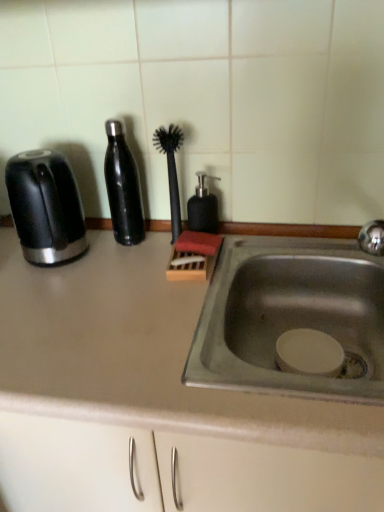
Find the location of a particular element. Image resolution: width=384 pixels, height=512 pixels. black glossy toaster at left is located at coordinates (45, 207).

What is the approximate width of matte gray countertop at center?

24.49 inches.

Image resolution: width=384 pixels, height=512 pixels. I want to click on stainless steel sink at center, so click(x=290, y=316).

Image resolution: width=384 pixels, height=512 pixels. I want to click on black matte soap dispenser at center, so click(x=203, y=207).

What do you see at coordinates (203, 207) in the screenshot? Image resolution: width=384 pixels, height=512 pixels. I see `black matte soap dispenser at center` at bounding box center [203, 207].

Image resolution: width=384 pixels, height=512 pixels. Identify the location of black rubber brush at center. (171, 170).

I want to click on satin black bottle at center left, so click(123, 187).

This screenshot has width=384, height=512. Find the location of `black glossy toaster at left`. black glossy toaster at left is located at coordinates (45, 207).

You are a GUI agent. You are given a task and a screenshot of the screen. Output one action in this format:
    pyautogui.click(x=<x>, y=<y>)
    Task: Click on the toaster beneath the black rubber brush at center (from a real-world perspective)
    
    Given the screenshot: What is the action you would take?
    pyautogui.click(x=45, y=207)

From the image's perspective, relative to black rubber brush at center, is black glossy toaster at left above or below?

From the image's perspective, black glossy toaster at left appears below black rubber brush at center.

Which of these two, black glossy toaster at left or black rubber brush at center, is bigger?

With larger size is black glossy toaster at left.

In the scene shown: Which of these two, black glossy toaster at left or black rubber brush at center, stands taller?

black rubber brush at center is taller.

Which of these two, satin black bottle at center left or matte gray countertop at center, is smaller?

With smaller size is satin black bottle at center left.

Considering the positions of point (139, 206) and point (205, 490), is point (139, 206) closer or farther from the camera than point (205, 490)?

Clearly, point (139, 206) is more distant from the camera than point (205, 490).

Based on the photo, considering the positions of objects satin black bottle at center left and matte gray countertop at center in the image provided, who is more to the left, satin black bottle at center left or matte gray countertop at center?

Positioned to the left is satin black bottle at center left.

From a real-world perspective, is black rubber brush at center under matte gray countertop at center?

Incorrect, from a real-world perspective, black rubber brush at center is higher than matte gray countertop at center.

I want to click on countertop in front of the black rubber brush at center, so click(153, 400).

From the image's perspective, would you say black rubber brush at center is shown under matte gray countertop at center?

Actually, black rubber brush at center appears above matte gray countertop at center in the image.

Which of these two, black rubber brush at center or matte gray countertop at center, is wider?

With larger width is matte gray countertop at center.

From the image's perspective, which is below, black matte soap dispenser at center or stainless steel sink at center?

stainless steel sink at center is shown below in the image.

The height and width of the screenshot is (512, 384). Identify the location of sink located in front of the black matte soap dispenser at center. (290, 316).

Would you consider black matte soap dispenser at center to be distant from stainless steel sink at center?

No.

Which of these two, black glossy toaster at left or black matte soap dispenser at center, stands taller?

Standing taller between the two is black glossy toaster at left.

Which object is wider, black glossy toaster at left or black matte soap dispenser at center?

black glossy toaster at left.

From the image's perspective, is black glossy toaster at left on top of black matte soap dispenser at center?

No.

Can you confirm if black glossy toaster at left is positioned to the right of black matte soap dispenser at center?

In fact, black glossy toaster at left is to the left of black matte soap dispenser at center.

In the scene shown: Measure the distance between satin black bottle at center left and stainless steel sink at center.

satin black bottle at center left is 15.16 inches from stainless steel sink at center.

Is satin black bottle at center left not within stainless steel sink at center?

Indeed, satin black bottle at center left is completely outside stainless steel sink at center.

The height and width of the screenshot is (512, 384). I want to click on sink below the satin black bottle at center left (from a real-world perspective), so click(x=290, y=316).

Is satin black bottle at center left far away from stainless steel sink at center?

satin black bottle at center left is near stainless steel sink at center, not far away.

Is stainless steel sink at center touching matte gray countertop at center?

No, stainless steel sink at center is not touching matte gray countertop at center.

Is stainless steel sink at center facing away from matte gray countertop at center?

No.

Does stainless steel sink at center appear on the left side of matte gray countertop at center?

Incorrect, stainless steel sink at center is not on the left side of matte gray countertop at center.

Locate an element on the screen. This screenshot has height=512, width=384. toaster in front of the black rubber brush at center is located at coordinates (45, 207).

This screenshot has height=512, width=384. In order to click on bottle on the left of matte gray countertop at center in this screenshot , I will do `click(123, 187)`.

Considering their positions, is satin black bottle at center left positioned closer to stainless steel sink at center than black glossy toaster at left?

satin black bottle at center left is closer to stainless steel sink at center.

When comparing their distances from matte gray countertop at center, does black glossy toaster at left or stainless steel sink at center seem further?

Among the two, black glossy toaster at left is located further to matte gray countertop at center.

When comparing their distances from matte gray countertop at center, does black rubber brush at center or satin black bottle at center left seem closer?

Among the two, satin black bottle at center left is located nearer to matte gray countertop at center.

Based on their spatial positions, is satin black bottle at center left or stainless steel sink at center closer to black glossy toaster at left?

satin black bottle at center left lies closer to black glossy toaster at left than the other object.

Looking at the image, which one is located closer to stainless steel sink at center, matte gray countertop at center or satin black bottle at center left?

matte gray countertop at center is closer to stainless steel sink at center.

From the image, which object appears to be farther from black rubber brush at center, matte gray countertop at center or black matte soap dispenser at center?

matte gray countertop at center lies further to black rubber brush at center than the other object.

Looking at the image, which one is located closer to black rubber brush at center, satin black bottle at center left or stainless steel sink at center?

satin black bottle at center left lies closer to black rubber brush at center than the other object.

Based on their spatial positions, is black rubber brush at center or stainless steel sink at center closer to matte gray countertop at center?

Based on the image, stainless steel sink at center appears to be nearer to matte gray countertop at center.

Where is `sink that lies between satin black bottle at center left and matte gray countertop at center from top to bottom`? This screenshot has height=512, width=384. sink that lies between satin black bottle at center left and matte gray countertop at center from top to bottom is located at coordinates (290, 316).

Locate an element on the screen. The image size is (384, 512). soap dispenser situated between black glossy toaster at left and stainless steel sink at center from left to right is located at coordinates (203, 207).

Locate an element on the screen. This screenshot has width=384, height=512. bottle between black glossy toaster at left and black rubber brush at center from left to right is located at coordinates (123, 187).

Find the location of `brush between stainless steel sink at center and black matte soap dispenser at center along the z-axis`. brush between stainless steel sink at center and black matte soap dispenser at center along the z-axis is located at coordinates (171, 170).